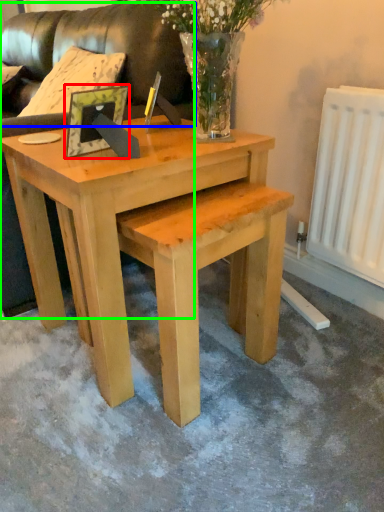
Question: Which object is the farthest from picture frame (highlighted by a red box)? Choose among these: couch (highlighted by a blue box) or couch (highlighted by a green box).

Choices:
 (A) couch
 (B) couch

Answer: (A)